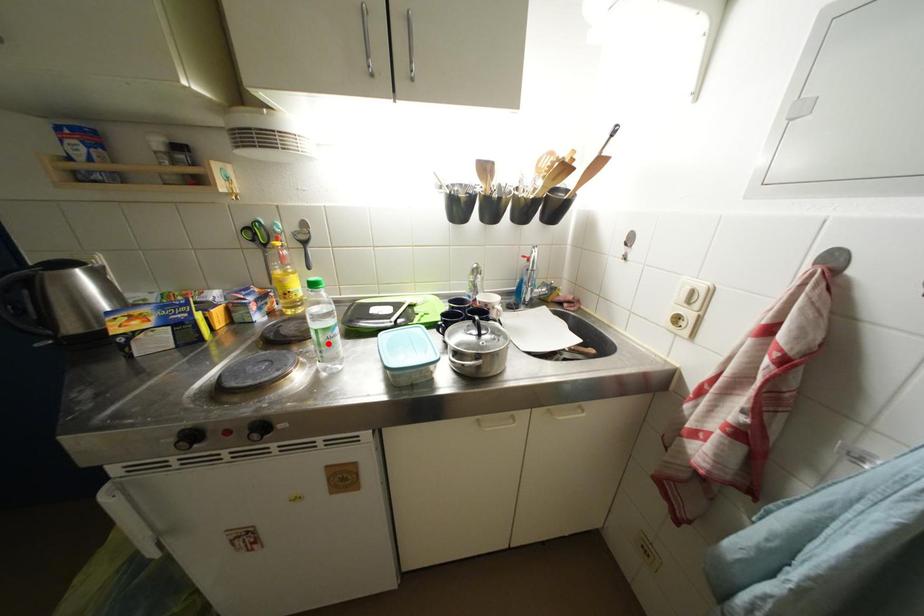
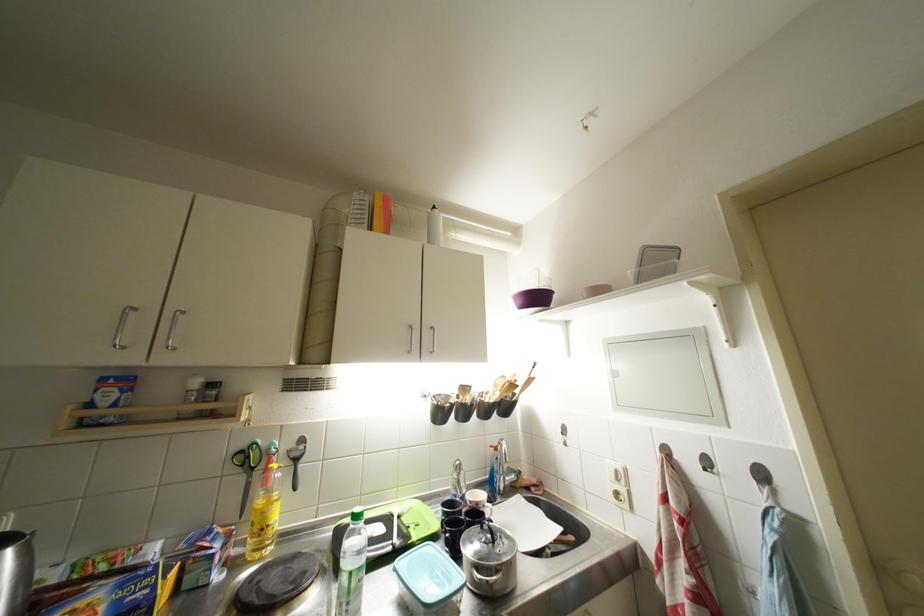
The point at the highlighted location is marked in the first image. Where is the corresponding point in the second image?

(359, 589)